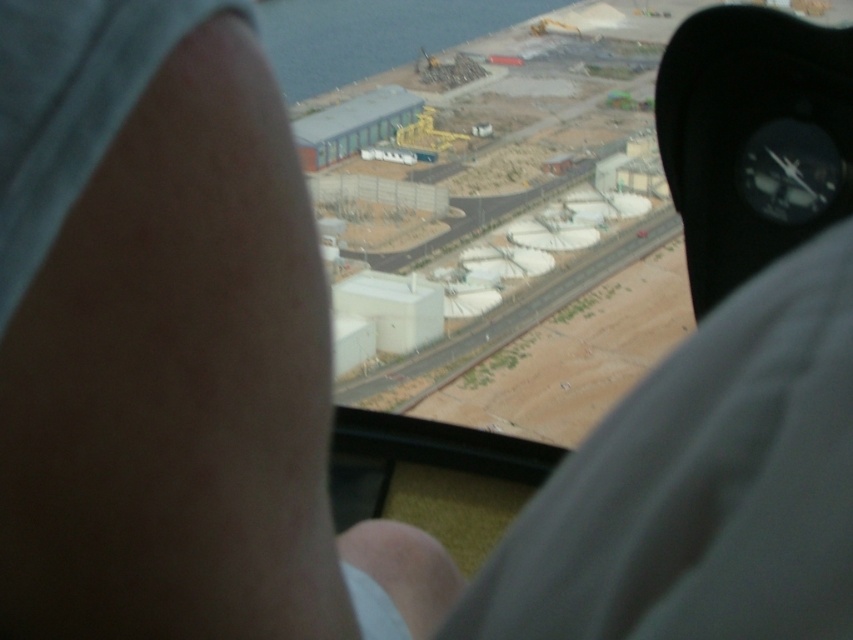
The height and width of the screenshot is (640, 853). I want to click on blue water at upper left, so click(372, 35).

Is blue water at upper left above white concrete train track at center?

Yes, blue water at upper left is above white concrete train track at center.

Does point (408, 29) lie in front of point (634, 259)?

No.

Locate an element on the screen. This screenshot has width=853, height=640. blue water at upper left is located at coordinates (372, 35).